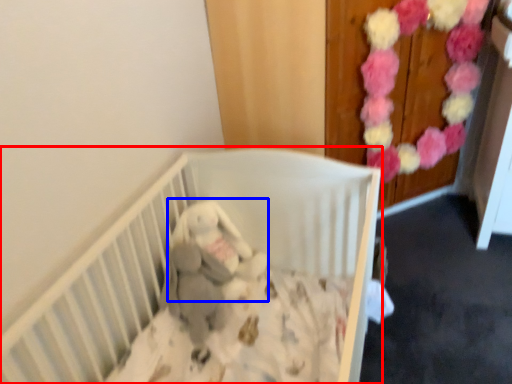
Question: Among these objects, which one is farthest to the camera, infant bed (highlighted by a red box) or baby elephant (highlighted by a blue box)?

Choices:
 (A) infant bed
 (B) baby elephant

Answer: (B)